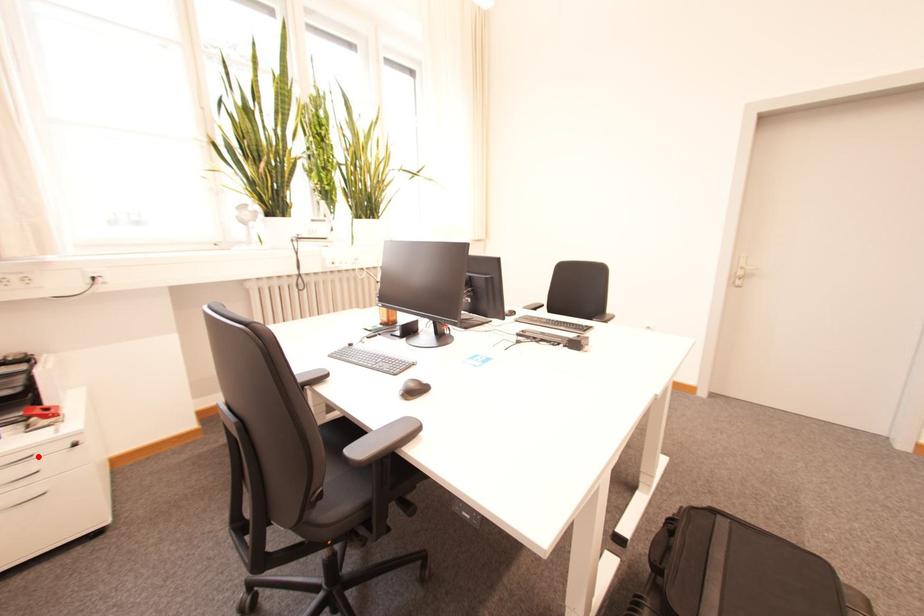
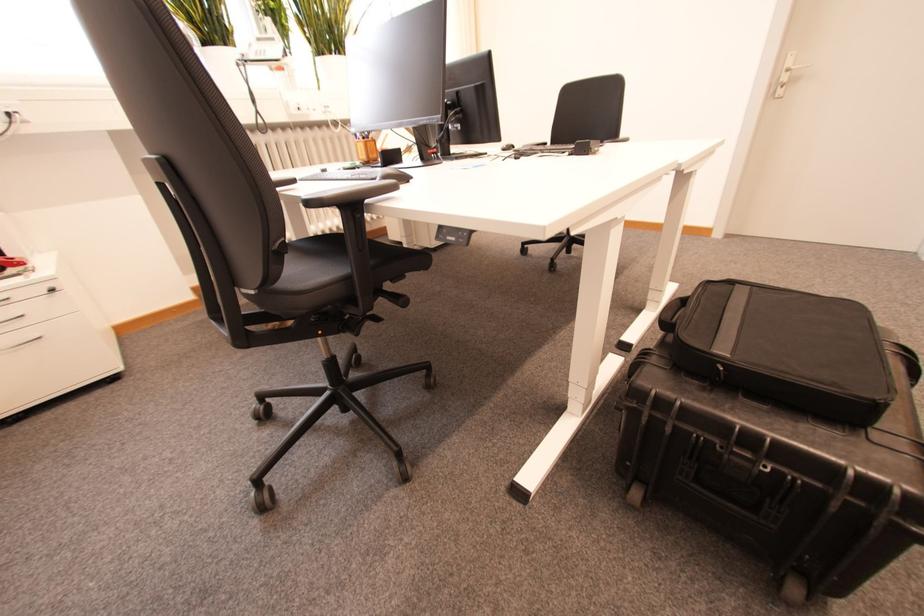
In the second image, find the point that corresponds to the highlighted location in the first image.

(15, 300)